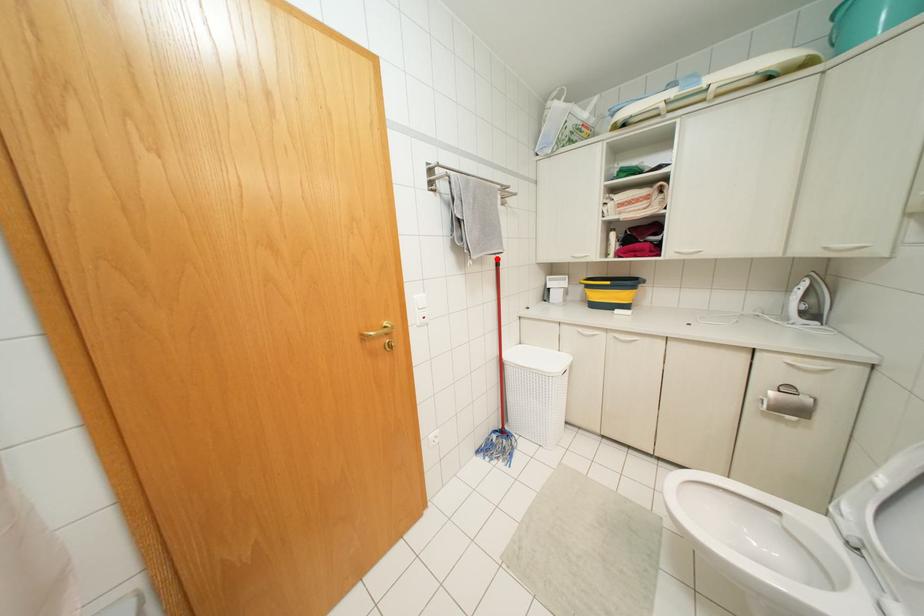
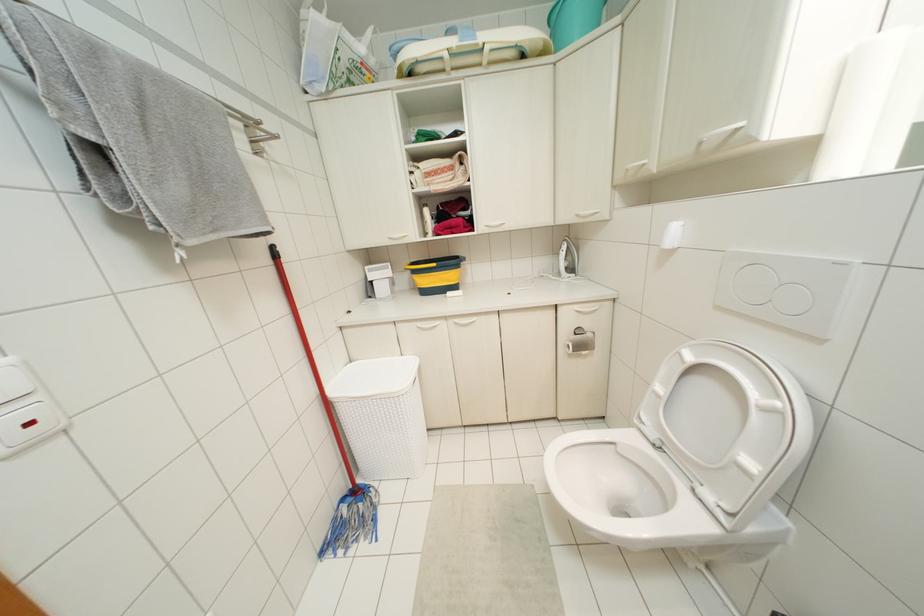
Find the pixel in the second image that matches the highlighted location in the first image.

(273, 246)